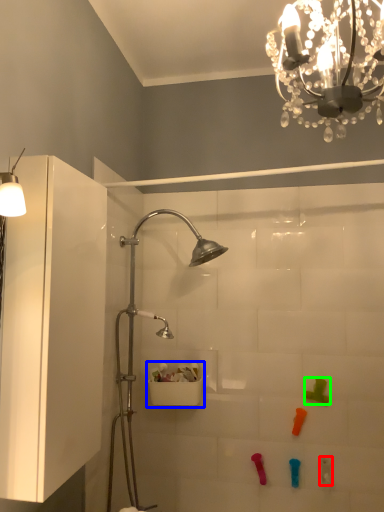
Question: Based on their relative distances, which object is nearer to toy (highlighted by a red box)? Choose from sink (highlighted by a blue box) and toy (highlighted by a green box).

Choices:
 (A) sink
 (B) toy

Answer: (B)